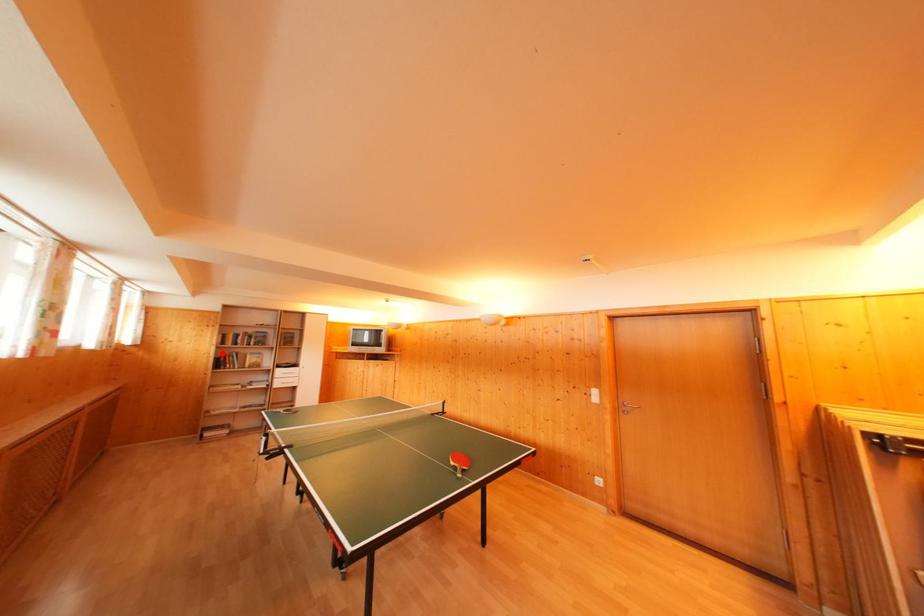
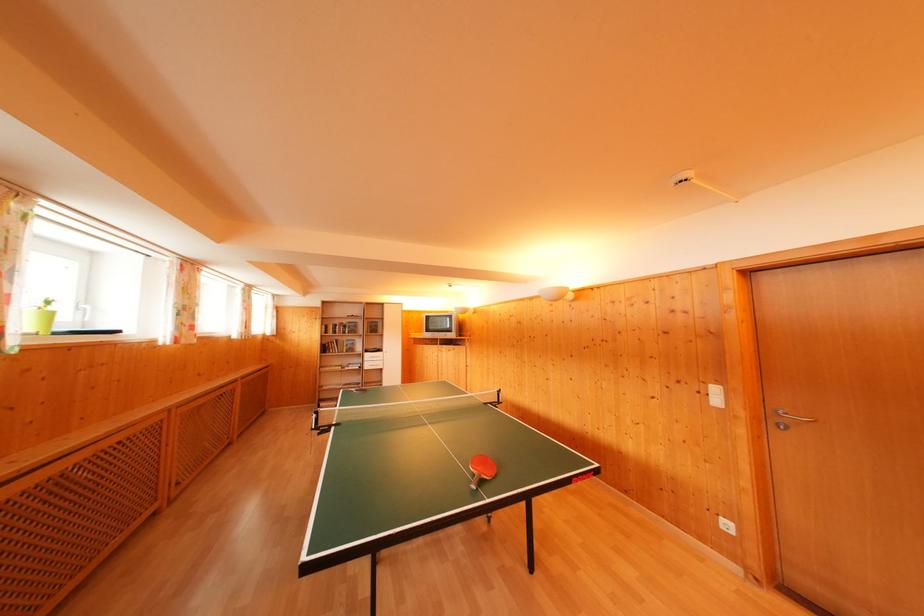
Locate, in the second image, the point that corresponds to the highlighted location in the first image.

(326, 342)